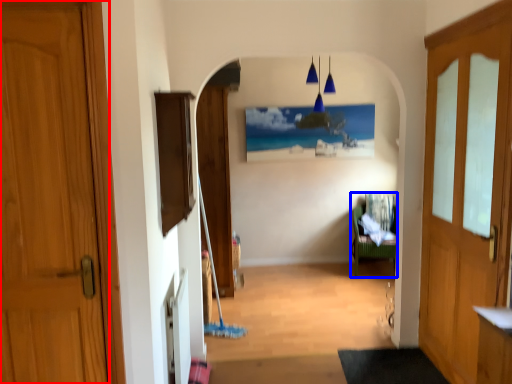
Question: Among these objects, which one is farthest to the camera, door (highlighted by a red box) or furniture (highlighted by a blue box)?

Choices:
 (A) door
 (B) furniture

Answer: (B)